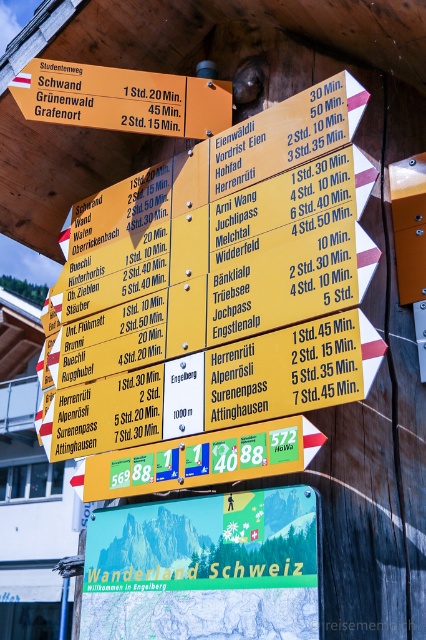
Which is below, green matte sign at center or yellow wood sign at upper center?

green matte sign at center is below.

Who is higher up, green matte sign at center or yellow wood sign at upper center?

yellow wood sign at upper center is higher up.

Between point (310, 605) and point (92, 108), which one is positioned in front?

Point (310, 605) is in front.

At what (x,y) coordinates should I click in order to perform the action: click on green matte sign at center. Please return your answer as a coordinate pair (x, y). Looking at the image, I should click on (204, 568).